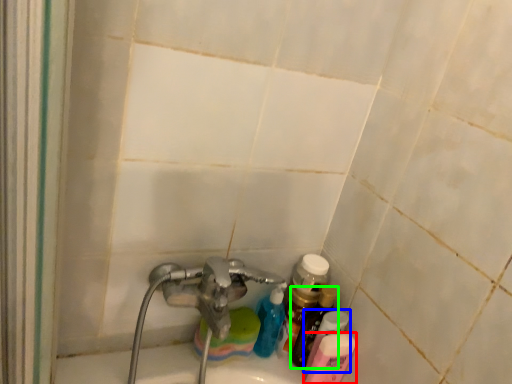
Question: Estimate the real-world distances between objects in this image. Which object is farther from toiletry (highlighted by a red box), toiletry (highlighted by a blue box) or bottle (highlighted by a green box)?

Choices:
 (A) toiletry
 (B) bottle

Answer: (B)